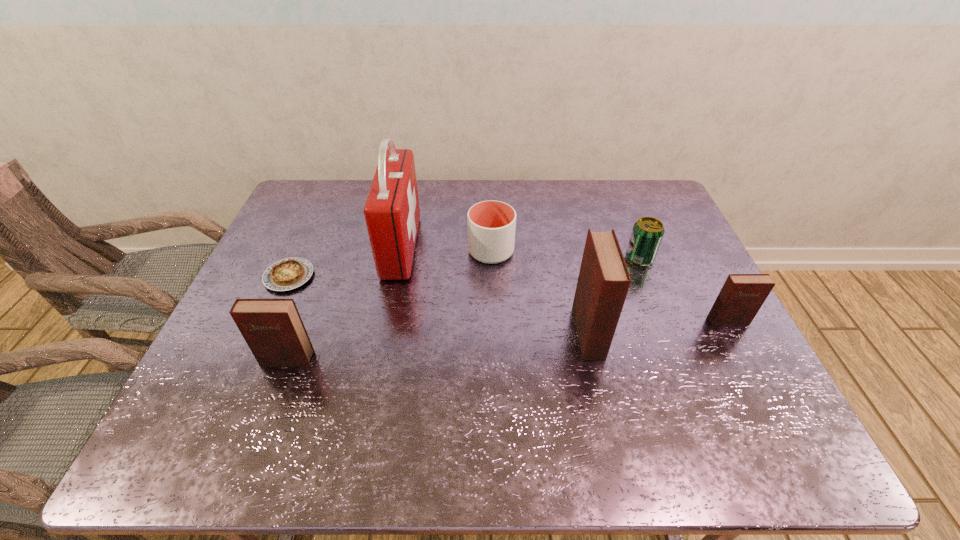
At what (x,y) coordinates should I click in order to perform the action: click on quiche that is positioned at the left edge. Please return your answer as a coordinate pair (x, y). The width and height of the screenshot is (960, 540). Looking at the image, I should click on (287, 274).

The width and height of the screenshot is (960, 540). What are the coordinates of `diary present at the right edge` in the screenshot? It's located at (742, 295).

At what (x,y) coordinates should I click in order to perform the action: click on beer can that is at the right edge. Please return your answer as a coordinate pair (x, y). This screenshot has width=960, height=540. Looking at the image, I should click on (647, 233).

Locate an element on the screen. The width and height of the screenshot is (960, 540). vacant space at the far edge of the desktop is located at coordinates click(530, 205).

In the image, there is a desktop. Identify the location of vacant space at the near edge. (423, 392).

The image size is (960, 540). In the image, there is a desktop. Find the location of `vacant space at the right edge`. vacant space at the right edge is located at coordinates (667, 245).

Locate an element on the screen. vacant region at the far left corner of the desktop is located at coordinates (311, 181).

Identify the location of vacant space at the near right corner. (699, 379).

I want to click on free space between the fifth object from right to left and the tallest diary, so click(494, 290).

At what (x,y) coordinates should I click in order to perform the action: click on free space between the third object from right to left and the quiche. Please return your answer as a coordinate pair (x, y). The height and width of the screenshot is (540, 960). Looking at the image, I should click on (439, 305).